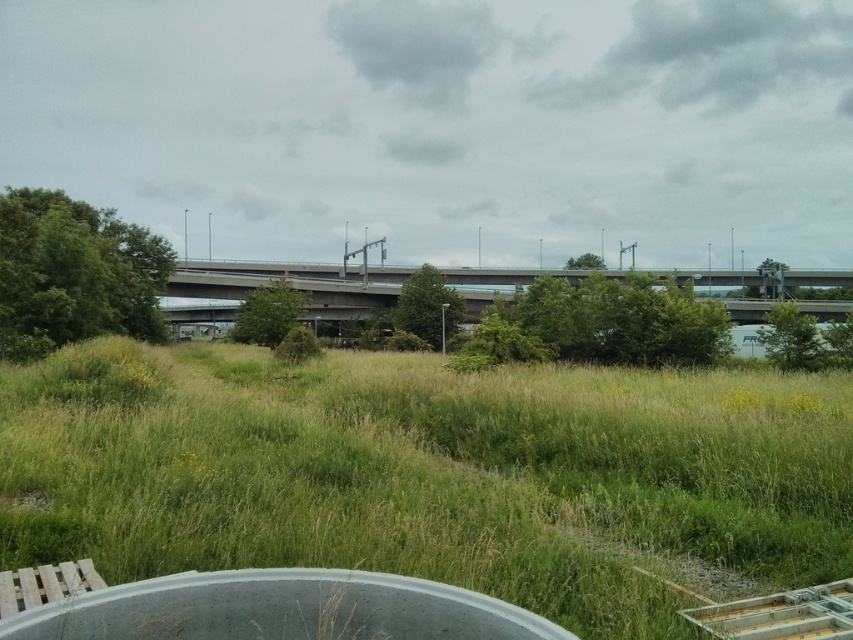
Who is shorter, green grassy field at center or concrete bridge at center?

Standing shorter between the two is green grassy field at center.

Can you confirm if green grassy field at center is bigger than concrete bridge at center?

No.

Who is more forward, (647, 602) or (206, 289)?

Point (647, 602) is in front.

Where is `green grassy field at center`? green grassy field at center is located at coordinates (431, 474).